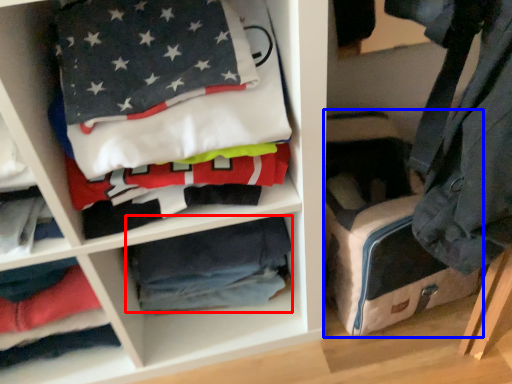
Question: Which object appears farthest to the camera in this image, material (highlighted by a red box) or pack (highlighted by a blue box)?

Choices:
 (A) material
 (B) pack

Answer: (A)